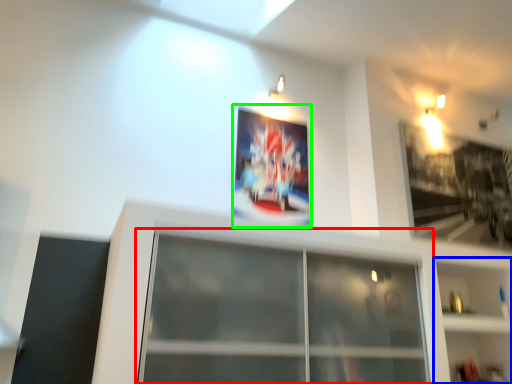
Question: Estimate the real-world distances between objects in this image. Which object is farther from window (highlighted by a red box), shelf (highlighted by a blue box) or picture frame (highlighted by a green box)?

Choices:
 (A) shelf
 (B) picture frame

Answer: (B)